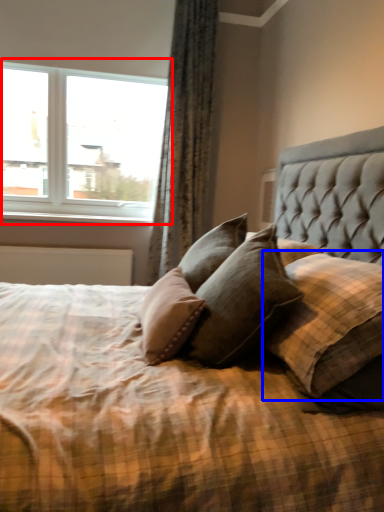
Question: Which point is further to the camera, window (highlighted by a red box) or pillow (highlighted by a blue box)?

Choices:
 (A) window
 (B) pillow

Answer: (A)